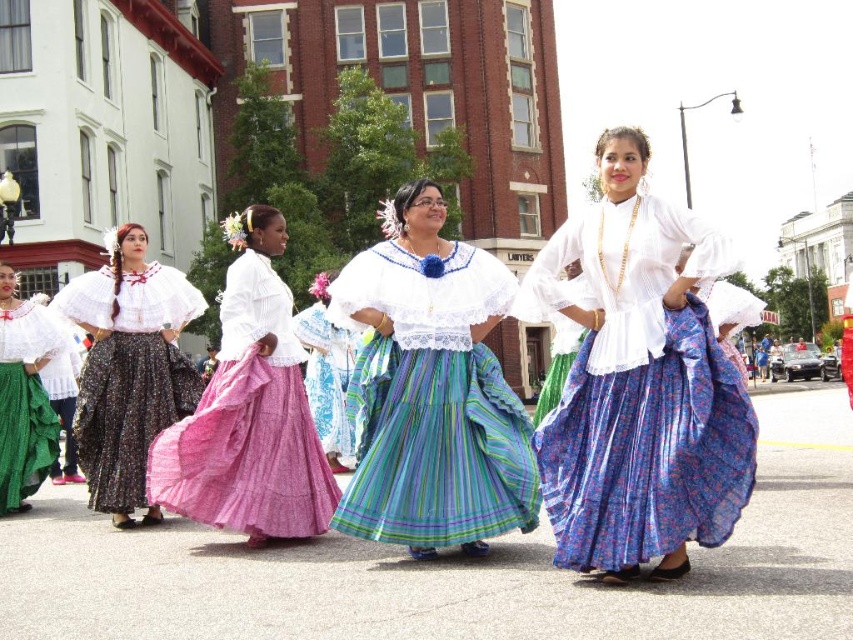
Question: Which point is farther from the camera taking this photo?

Choices:
 (A) (341, 438)
 (B) (692, 307)
 (C) (49, 413)

Answer: (A)

Question: Is pink fabric skirt at center to the right of green textured skirt at left from the viewer's perspective?

Choices:
 (A) yes
 (B) no

Answer: (A)

Question: Considering the real-world distances, which object is farthest from the green textured skirt at left?

Choices:
 (A) striped cotton dress at center
 (B) floral cotton skirt at center
 (C) pink fabric skirt at center

Answer: (B)

Question: Is striped cotton dress at center above matte black dress at left?

Choices:
 (A) no
 (B) yes

Answer: (B)

Question: Can you confirm if matte black dress at left is bigger than green textured skirt at left?

Choices:
 (A) yes
 (B) no

Answer: (A)

Question: Among these points, which one is nearest to the camera?

Choices:
 (A) [x=554, y=444]
 (B) [x=30, y=420]

Answer: (A)